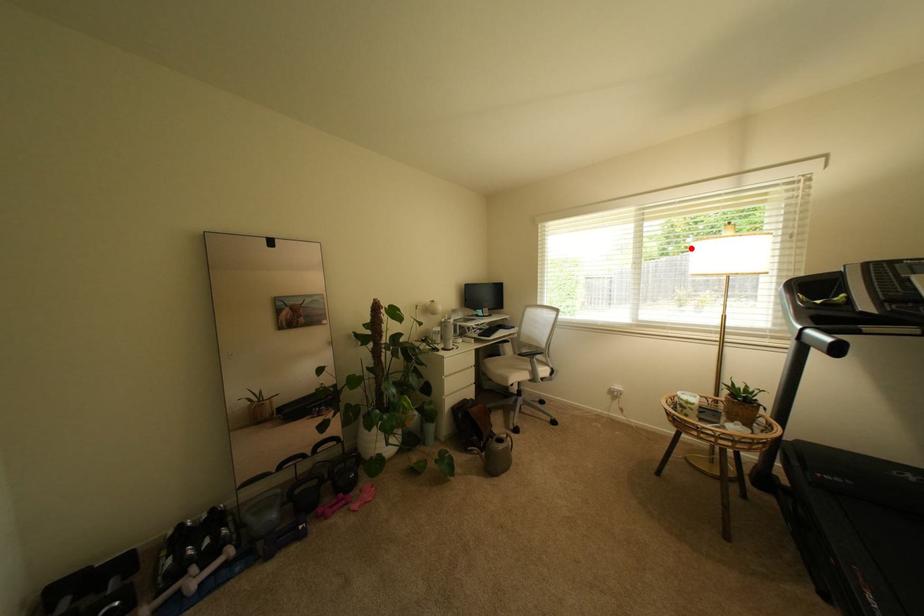
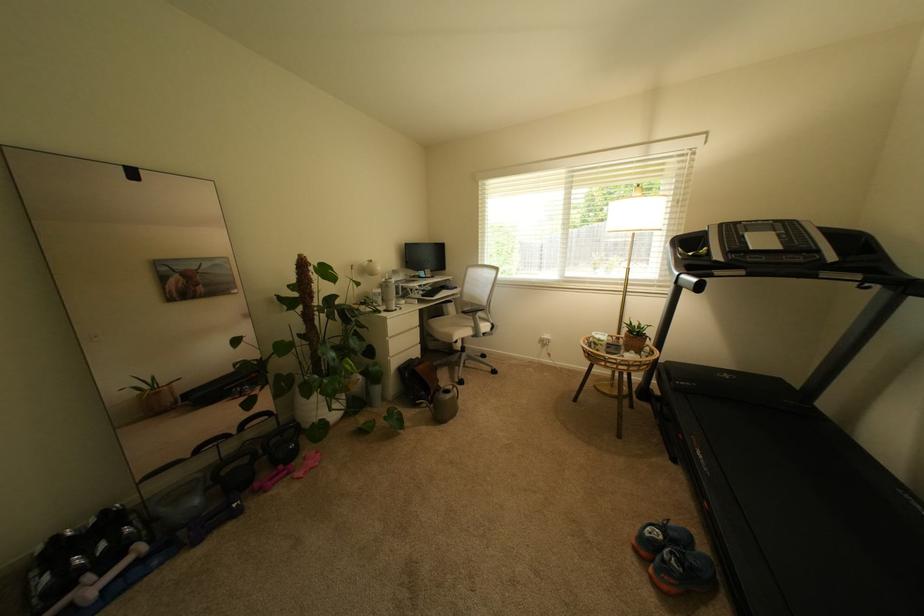
Question: I am providing you with two images of the same scene from different viewpoints. Image1 has a red point marked. In image2, the corresponding 3D location appears at what relative position? Reply with the corresponding letter.

Choices:
 (A) Closer
 (B) Farther

Answer: (A)